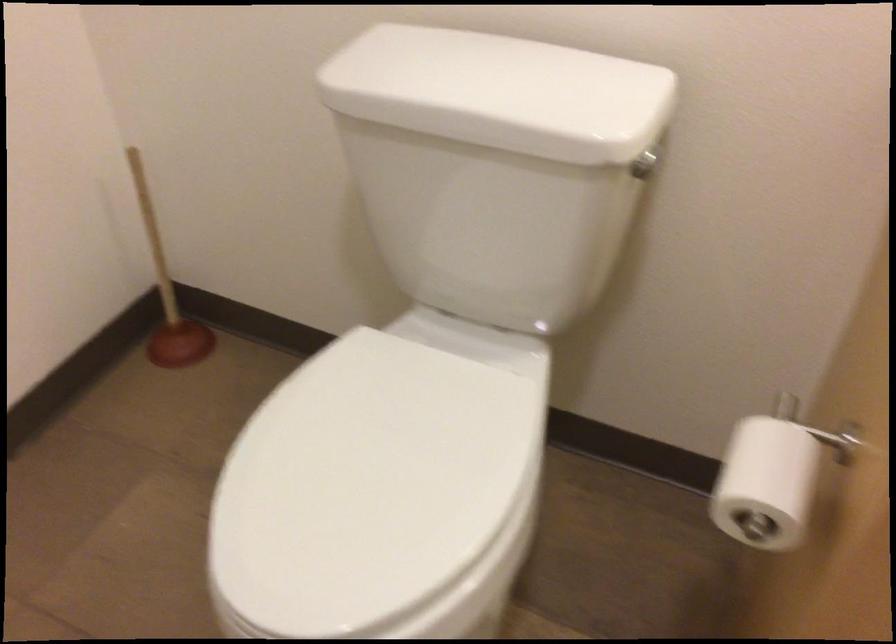
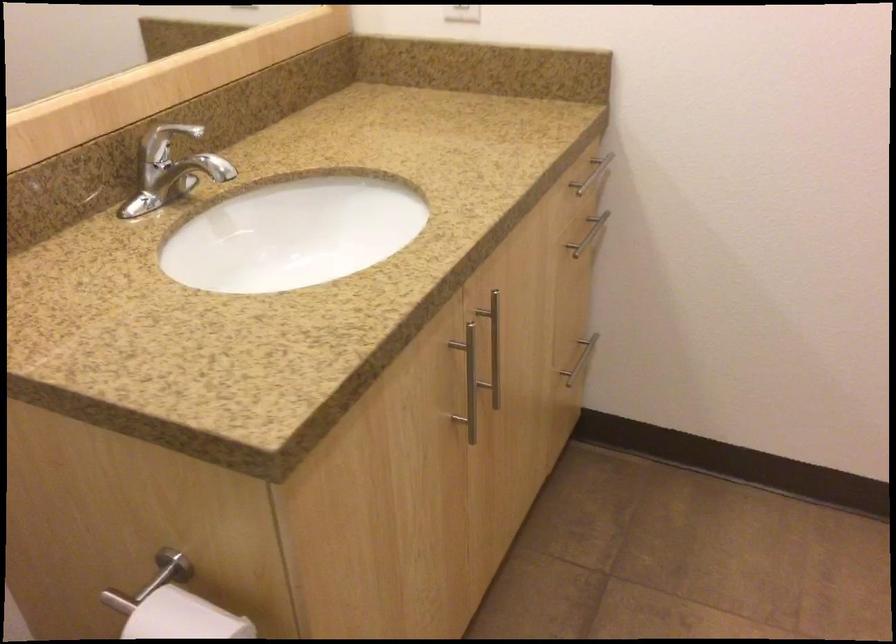
The point at (782,450) is marked in the first image. Where is the corresponding point in the second image?

(183, 618)